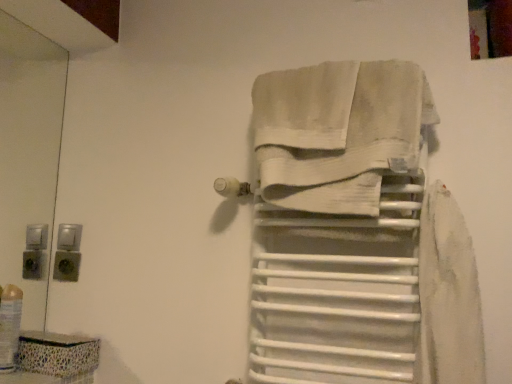
Question: Based on their sizes in the image, would you say translucent plastic bottle at lower left is bigger or smaller than white cotton towel at center?

Choices:
 (A) big
 (B) small

Answer: (B)

Question: In the image, is translucent plastic bottle at lower left on the left side or the right side of white cotton towel at center?

Choices:
 (A) left
 (B) right

Answer: (A)

Question: Which object is positioned closest to the white matte towel rack at center?

Choices:
 (A) translucent plastic bottle at lower left
 (B) white cotton towel at center

Answer: (B)

Question: Which of these objects is positioned farthest from the white cotton towel at center?

Choices:
 (A) translucent plastic bottle at lower left
 (B) white matte towel rack at center

Answer: (A)